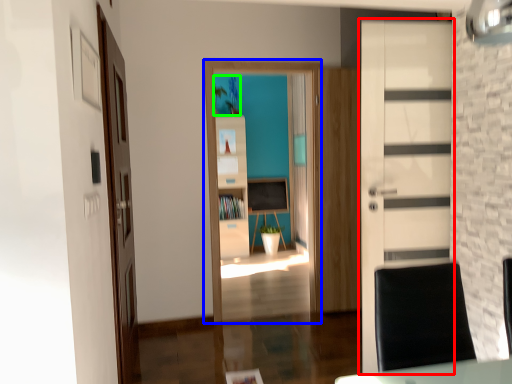
Question: Which object is positioned farthest from door (highlighted by a red box)? Select from entertainment center (highlighted by a blue box) and plant (highlighted by a green box).

Choices:
 (A) entertainment center
 (B) plant

Answer: (B)